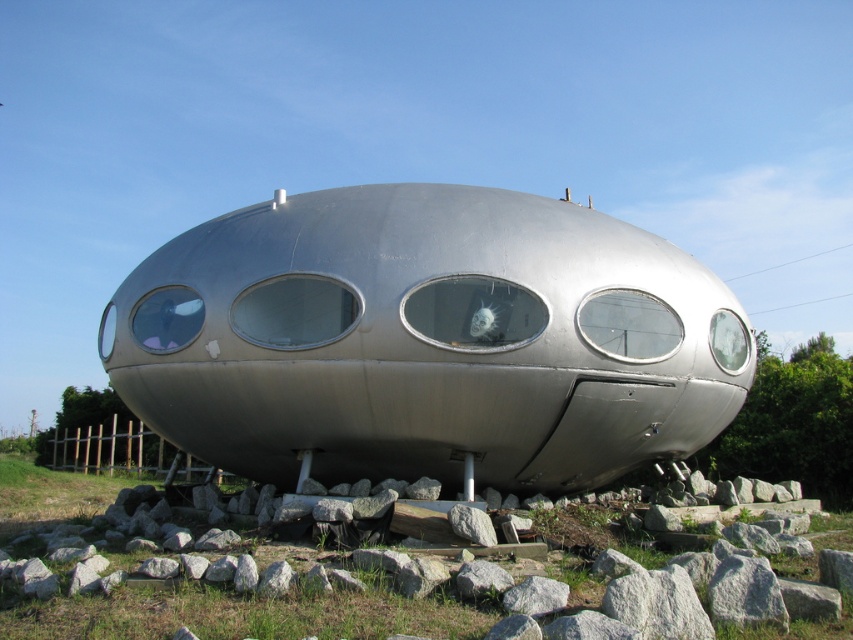
You are standing in front of the futuristic pod and want to place a small plant pot that is 1 meter tall on the gray rock at lower center. Considering the distance between you and the rock, can you safely reach the rock to place the pot without moving closer?

The gray rock at lower center is 5.68 meters away from the viewer. Since the plant pot is only 1 meter tall, the distance of over 5 meters makes it difficult to accurately place the pot on the rock without moving closer. You should move closer to ensure safe placement.

From the picture: You are standing in front of the futuristic pod and need to place a small plant exactly at the gray rock at lower center. According to the coordinates provided, where should you position the plant?

The gray rock at lower center is located at point coordinates (196, 586), so you should position the plant at those exact coordinates to place it correctly on the gray rock at lower center.